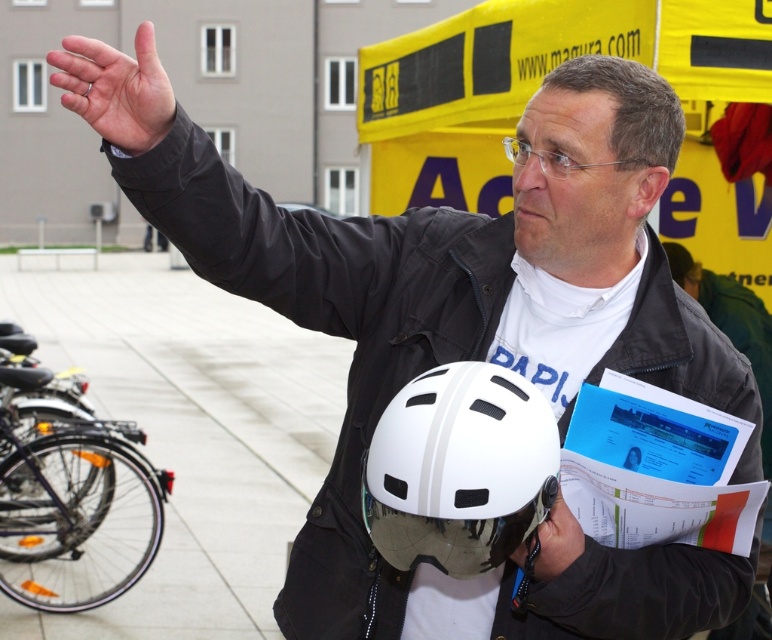
Question: Which of the following is the closest to the observer?

Choices:
 (A) (537, 576)
 (B) (163, 100)
 (C) (489, 461)

Answer: (C)

Question: In this image, where is white matte helmet at center located relative to matte black hand at upper left?

Choices:
 (A) right
 (B) left

Answer: (A)

Question: Which point appears farthest from the camera in this image?

Choices:
 (A) (157, 141)
 (B) (520, 552)
 (C) (401, 538)

Answer: (B)

Question: Does white matte helmet at center have a larger size compared to matte black hand at upper left?

Choices:
 (A) no
 (B) yes

Answer: (A)

Question: Which object is closer to the camera taking this photo?

Choices:
 (A) white matte helmet at center
 (B) white matte helmet at lower center
 (C) matte black hand at upper left

Answer: (C)

Question: Can you confirm if white matte helmet at center is positioned to the left of white matte helmet at lower center?

Choices:
 (A) yes
 (B) no

Answer: (A)